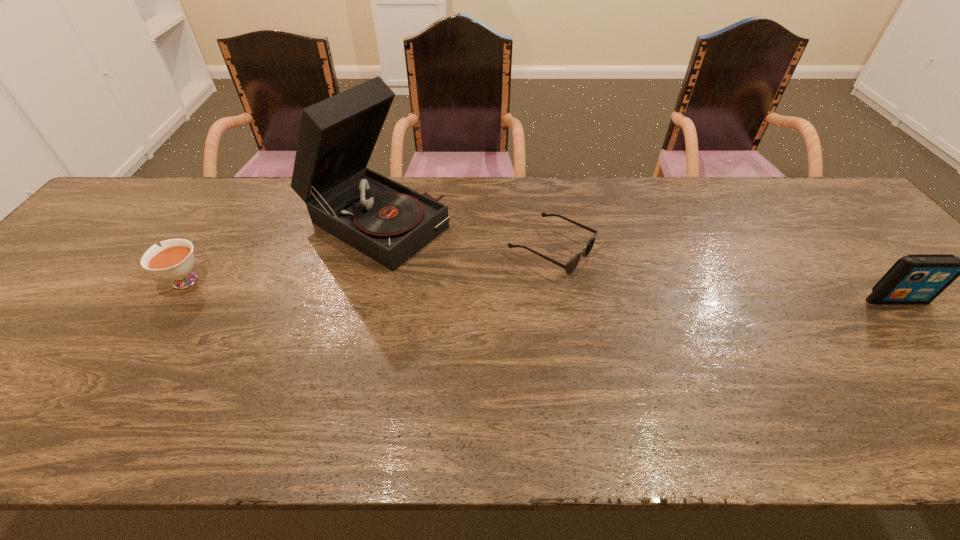
Locate an element on the screen. free spot that satisfies the following two spatial constraints: 1. on the front side of the second object from right to left; 2. on the left side of the tallest object is located at coordinates (368, 250).